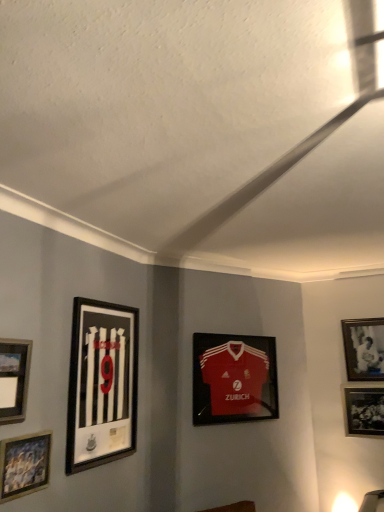
Question: From a real-world perspective, is black matte picture frame at left, positioned as the 3th picture frame in left-to-right order, above or below white matte picture frame at upper right, which is the 1th picture frame from right to left?

Choices:
 (A) above
 (B) below

Answer: (B)

Question: Based on their sizes in the image, would you say black matte picture frame at left, positioned as the 3th picture frame in left-to-right order, is bigger or smaller than white matte picture frame at upper right, arranged as the 6th picture frame when viewed from the left?

Choices:
 (A) big
 (B) small

Answer: (A)

Question: Considering the real-world distances, which object is farthest from the matte plastic picture frame at center, which is counted as the 3th picture frame, starting from the right?

Choices:
 (A) wooden picture frame at lower left, acting as the fifth picture frame starting from the right
 (B) white matte picture frame at upper right, which is the 1th picture frame from right to left
 (C) black matte picture frame at left, the 4th picture frame in the right-to-left sequence
 (D) black matte photo frame at lower right, which ranks as the 5th picture frame in left-to-right order
 (E) matte silver picture frame at lower left, the first picture frame when ordered from left to right

Answer: (E)

Question: Estimate the real-world distances between objects in this image. Which object is closer to the white matte picture frame at upper right, arranged as the 6th picture frame when viewed from the left?

Choices:
 (A) matte plastic picture frame at center, which is counted as the 3th picture frame, starting from the right
 (B) black matte photo frame at lower right, placed as the second picture frame when sorted from right to left
 (C) matte silver picture frame at lower left, the sixth picture frame when ordered from right to left
 (D) wooden picture frame at lower left, acting as the fifth picture frame starting from the right
 (E) black matte picture frame at left, positioned as the 3th picture frame in left-to-right order

Answer: (B)